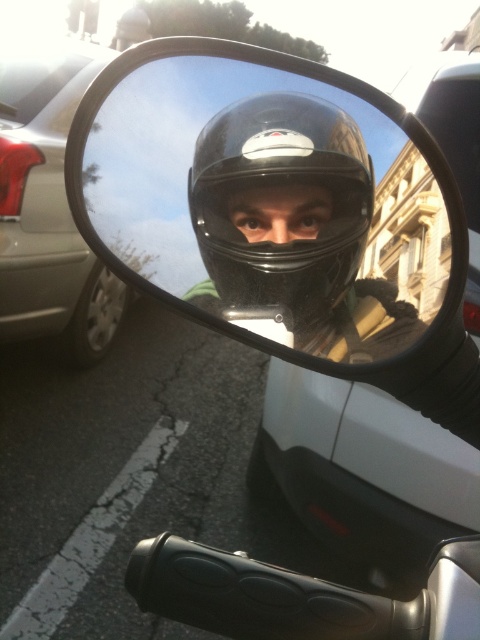
Question: Does transparent plastic mirror at center come in front of metallic silver car at left?

Choices:
 (A) no
 (B) yes

Answer: (B)

Question: Considering the real-world distances, which object is closest to the transparent plastic mirror at center?

Choices:
 (A) metallic silver car at left
 (B) matte black helmet at center
 (C) black matte helmet at center

Answer: (C)

Question: Which point appears closest to the camera in this image?

Choices:
 (A) (7, 243)
 (B) (217, 77)
 (C) (239, 179)
 (D) (280, 200)

Answer: (B)

Question: Does transparent plastic mirror at center appear on the right side of black matte helmet at center?

Choices:
 (A) no
 (B) yes

Answer: (A)

Question: Does transparent plastic mirror at center have a greater width compared to metallic silver car at left?

Choices:
 (A) yes
 (B) no

Answer: (B)

Question: Which object is closer to the camera taking this photo?

Choices:
 (A) metallic silver car at left
 (B) black matte helmet at center
 (C) matte black helmet at center
 (D) transparent plastic mirror at center

Answer: (D)